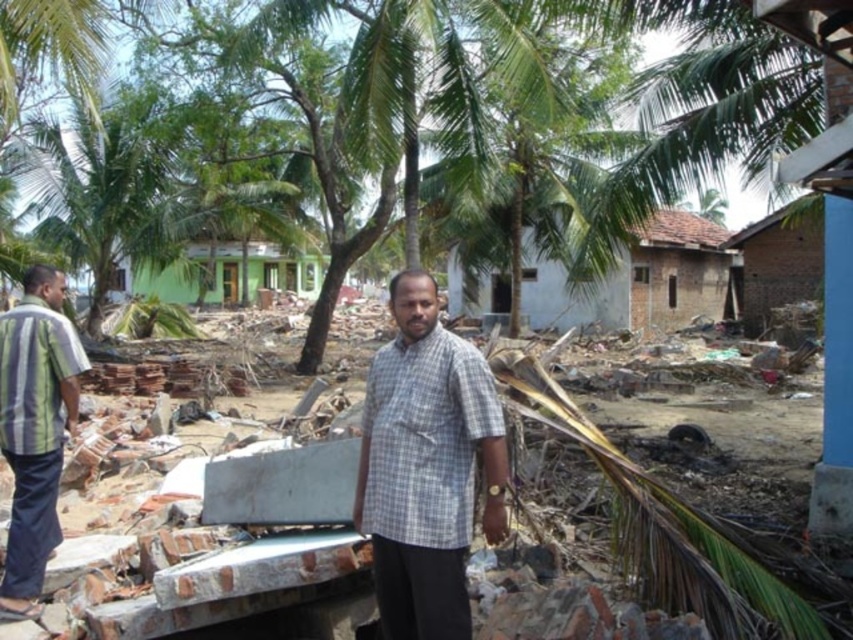
Does striped cotton shirt at left appear on the left side of brown brick hut at center right?

Correct, you'll find striped cotton shirt at left to the left of brown brick hut at center right.

Is striped cotton shirt at left bigger than brown brick hut at center right?

No, striped cotton shirt at left is not bigger than brown brick hut at center right.

Between point (86, 369) and point (718, 273), which one is positioned behind?

The point (718, 273) is more distant.

Where is `striped cotton shirt at left`? striped cotton shirt at left is located at coordinates (35, 428).

Is striped cotton shirt at left smaller than green painted wood house at center?

Yes.

Does striped cotton shirt at left lie in front of green painted wood house at center?

That is True.

Does point (28, 552) lie in front of point (114, 278)?

Yes.

Locate an element on the screen. This screenshot has height=640, width=853. striped cotton shirt at left is located at coordinates (35, 428).

Does gray checkered shirt at center appear under brown brick hut at upper right?

Correct, gray checkered shirt at center is located below brown brick hut at upper right.

Does gray checkered shirt at center appear over brown brick hut at upper right?

Actually, gray checkered shirt at center is below brown brick hut at upper right.

At what (x,y) coordinates should I click in order to perform the action: click on gray checkered shirt at center. Please return your answer as a coordinate pair (x, y). Looking at the image, I should click on (426, 465).